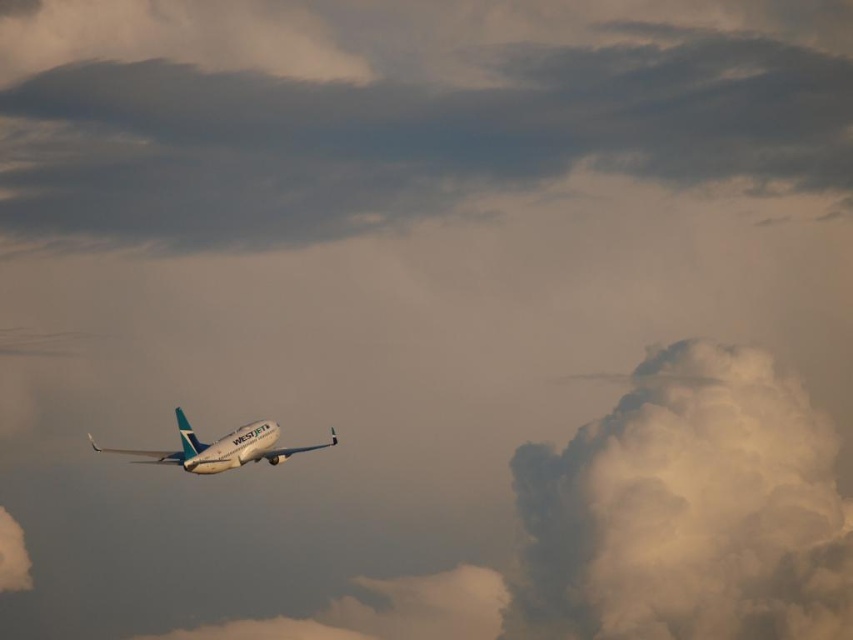
You are a pilot viewing the sky through the cockpit window of the WestJet airplane. You notice a point marked at coordinates (x=396, y=109). What object is located at this point?

The point at coordinates (x=396, y=109) corresponds to a gray fluffy cloud at upper center.

You are a pilot flying the WestJet airplane in the scene. You need to navigate around a potential obstacle. Based on the image, where is the white fluffy cloud at upper right located in terms of your current position?

The white fluffy cloud at upper right is located at the upper right position in the image, which would be to the right and above your current position as the pilot.

You are a pilot flying the white glossy airplane at center. You notice a gray fluffy cloud at upper center ahead. Can you see the ground through the cloud?

The white glossy airplane at center is behind the gray fluffy cloud at upper center, so the cloud is blocking your view of the ground.